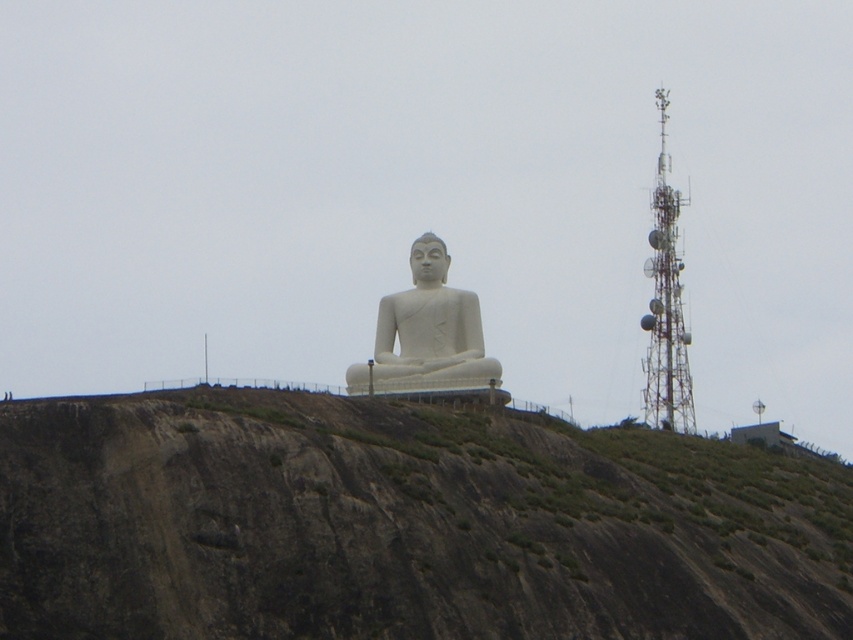
Can you confirm if brown rocky hillside at center is taller than white marble statue at center?

Yes.

From the picture: Who is taller, brown rocky hillside at center or white marble statue at center?

brown rocky hillside at center is taller.

Who is more distant from viewer, (602, 509) or (473, 352)?

Positioned behind is point (473, 352).

This screenshot has height=640, width=853. What are the coordinates of `brown rocky hillside at center` in the screenshot? It's located at (403, 525).